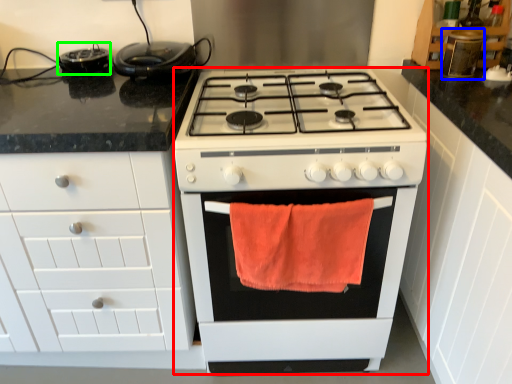
Question: Based on their relative distances, which object is farther from appliance (highlighted by a red box)? Choose from appliance (highlighted by a blue box) and appliance (highlighted by a green box).

Choices:
 (A) appliance
 (B) appliance

Answer: (B)